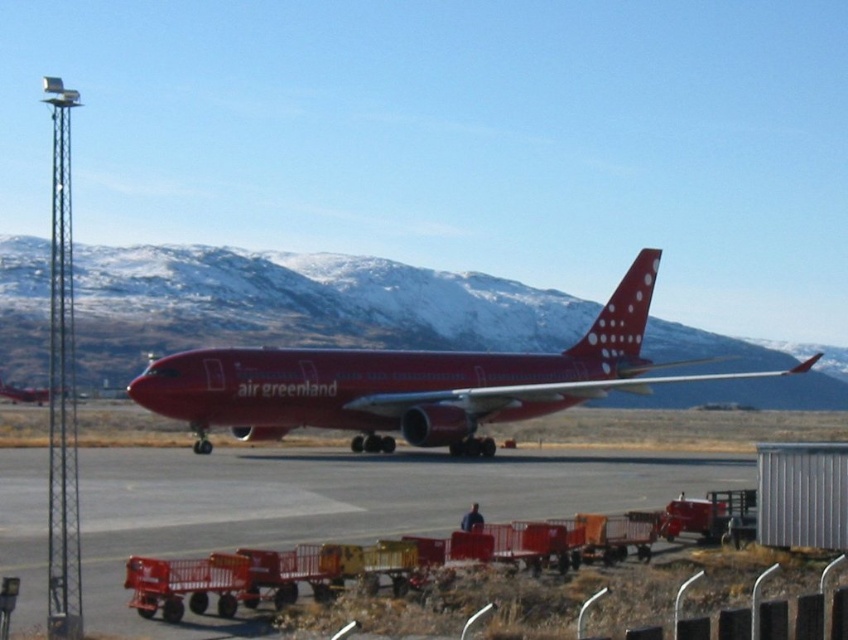
From the picture: You are a ground crew member standing on the metallic gray tarmac at center. You need to walk to the polished red airplane at center. Which direction should you walk?

The metallic gray tarmac at center is to the left of the polished red airplane at center, so you should walk to the right to reach the polished red airplane at center.

You are standing at the edge of the tarmac near the Air Greenland airplane. You want to walk to the point marked at coordinate point (240, 509). How far will you have to walk?

The point at coordinate (240, 509) is 22.51 meters away from the viewer, so you will have to walk 22.51 meters to reach it.

What is the 2D coordinate of the metallic gray tarmac at center?

The metallic gray tarmac at center is located at the 2D coordinate point of (x=339, y=502).